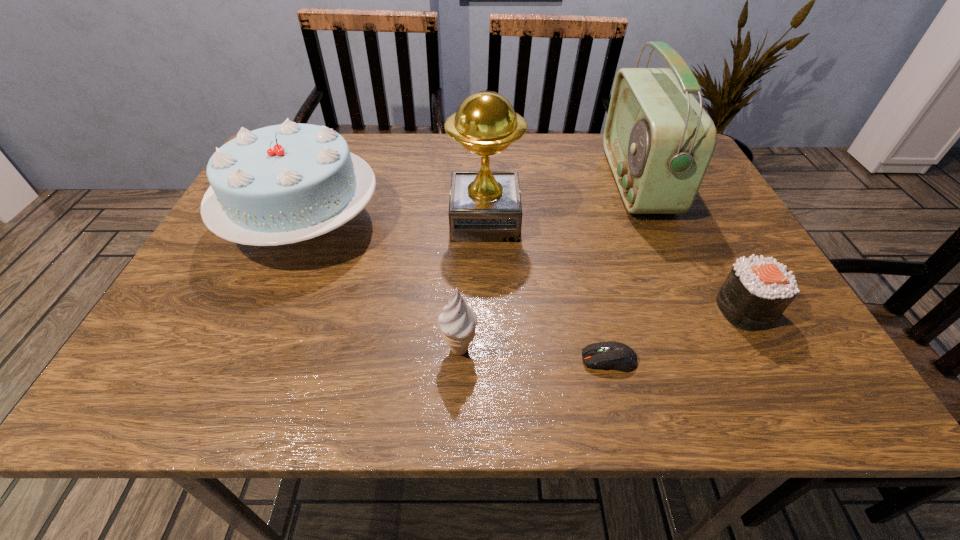
This screenshot has width=960, height=540. In the image, there is a desktop. Find the location of `free region at the far edge`. free region at the far edge is located at coordinates click(399, 171).

The image size is (960, 540). In order to click on vacant space at the near edge of the desktop in this screenshot , I will do `click(708, 402)`.

Locate an element on the screen. The height and width of the screenshot is (540, 960). vacant region at the left edge of the desktop is located at coordinates (252, 276).

You are a GUI agent. You are given a task and a screenshot of the screen. Output one action in this format:
    pyautogui.click(x=<x>, y=<y>)
    Task: Click on the free location at the right edge of the desktop
    
    Given the screenshot: What is the action you would take?
    pyautogui.click(x=799, y=351)

Identify the location of free space that is in between the icecream and the award. The width and height of the screenshot is (960, 540). (472, 285).

This screenshot has width=960, height=540. In order to click on free area in between the third object from right to left and the radio receiver in this screenshot , I will do click(x=623, y=270).

Where is `free spot between the radio receiver and the icecream`? The height and width of the screenshot is (540, 960). free spot between the radio receiver and the icecream is located at coordinates (548, 265).

Find the location of a particular element. vacant point located between the icecream and the sushi is located at coordinates (602, 329).

This screenshot has width=960, height=540. In order to click on free space between the leftmost object and the fifth tallest object in this screenshot , I will do `click(524, 266)`.

Where is `vacant region between the award and the leftmost object`? The image size is (960, 540). vacant region between the award and the leftmost object is located at coordinates (395, 222).